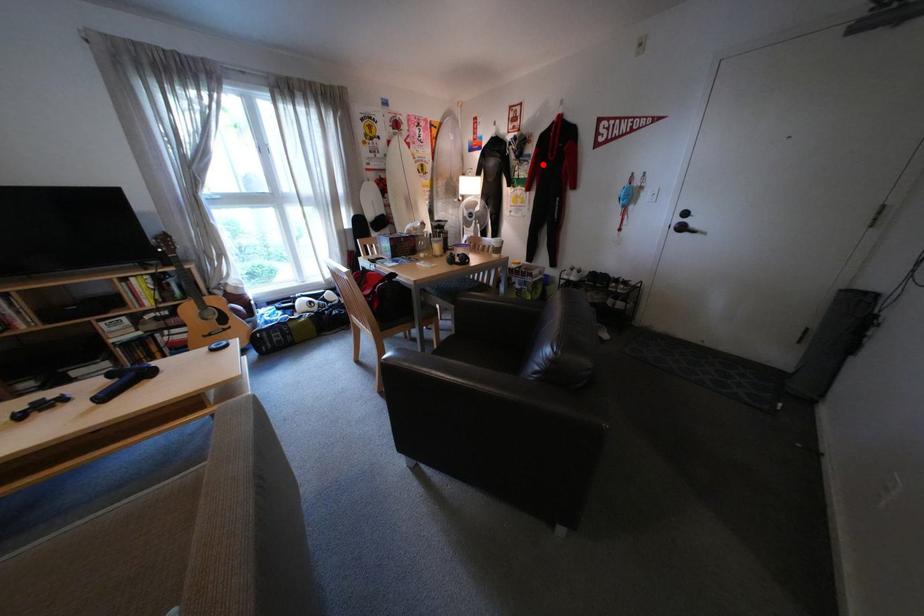
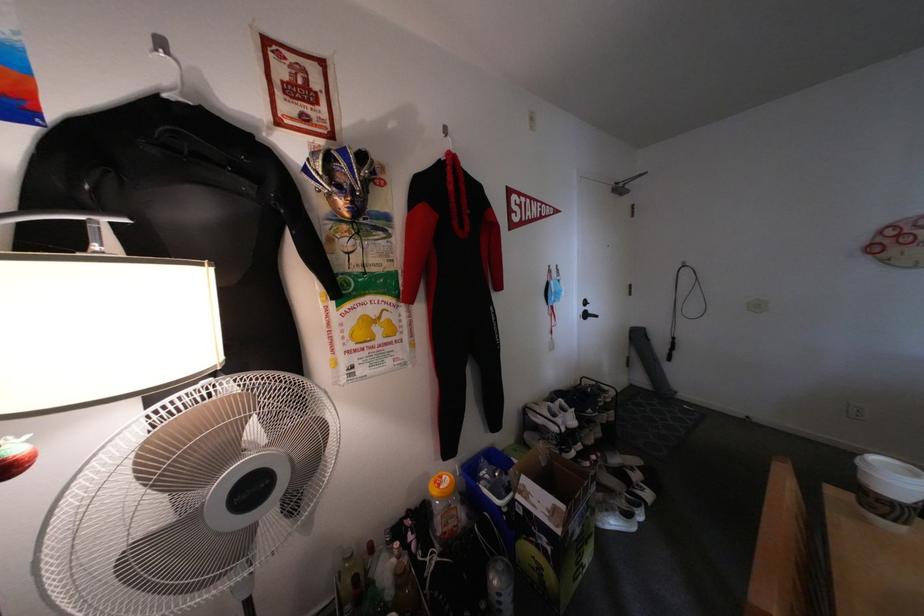
Find the pixel in the second image that matches the highlighted location in the first image.

(404, 237)